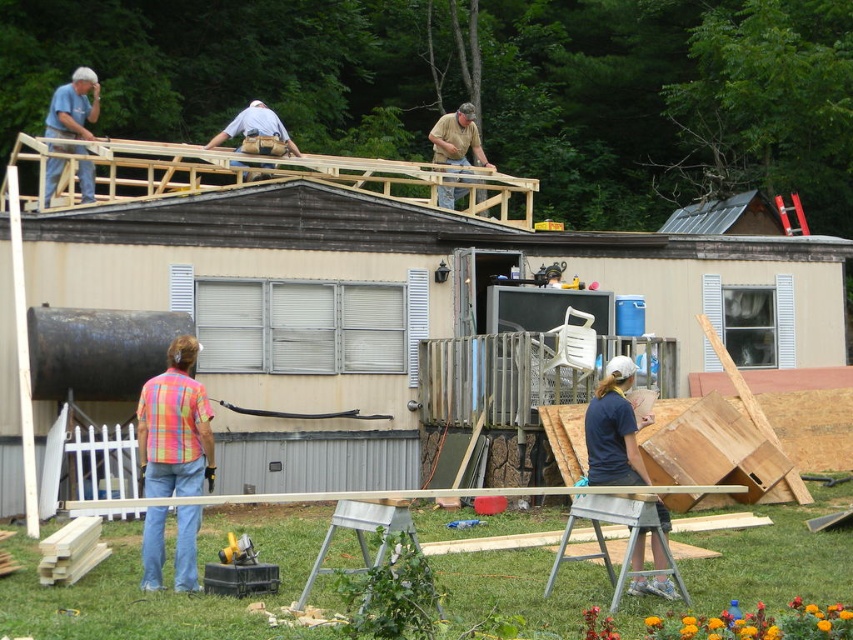
You are a construction supervisor observing the workers in the scene. You notice two workers wearing a multicolored plaid shirt at lower left and a matte blue shirt at upper left. Which worker is standing taller?

The multicolored plaid shirt at lower left is taller than the matte blue shirt at upper left, so the worker in the multicolored plaid shirt at lower left is standing taller.

You are standing at the origin point of the coordinate system where the mobile home is located. The construction site uses a coordinate system where the bottom left corner of the mobile home is the origin point. Can you determine if the blue fabric shirt at center is located in the upper half of the mobile home?

The blue fabric shirt at center is located at coordinate point (613,429). Since the y coordinate is 0.720, which is above the midpoint of 0.5, the blue fabric shirt at center is in the upper half of the mobile home.